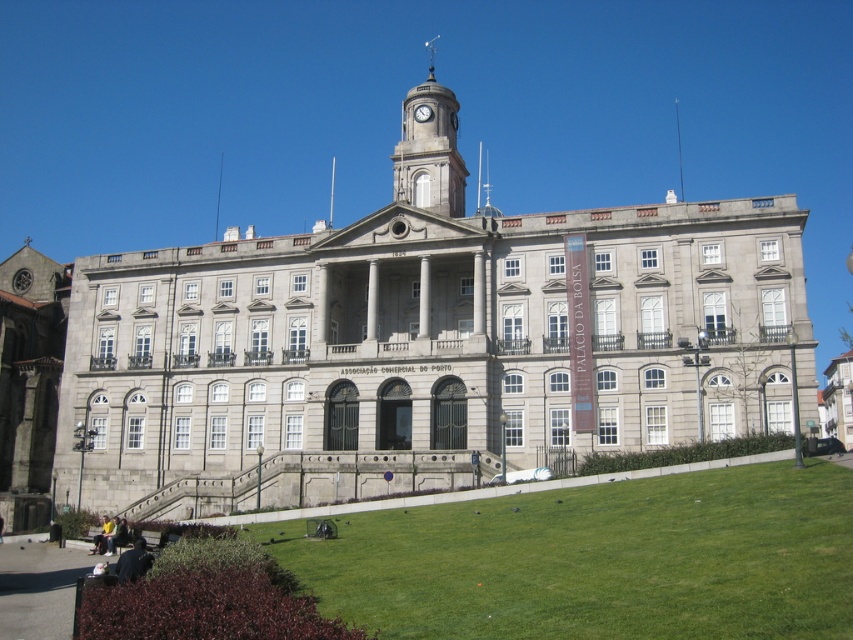
Question: Which point is closer to the camera?

Choices:
 (A) white glossy clock at center
 (B) green grass at lower center
 (C) smooth gray clock tower at upper center

Answer: (B)

Question: Which point is closer to the camera taking this photo?

Choices:
 (A) (608, 634)
 (B) (425, 189)
 (C) (416, 109)

Answer: (A)

Question: Is green grass at lower center further to the viewer compared to smooth gray clock tower at upper center?

Choices:
 (A) no
 (B) yes

Answer: (A)

Question: Among these points, which one is nearest to the camera?

Choices:
 (A) (664, 634)
 (B) (421, 113)
 (C) (434, 99)

Answer: (A)

Question: Does green grass at lower center come in front of white glossy clock at center?

Choices:
 (A) no
 (B) yes

Answer: (B)

Question: Is green grass at lower center wider than white glossy clock at center?

Choices:
 (A) yes
 (B) no

Answer: (A)